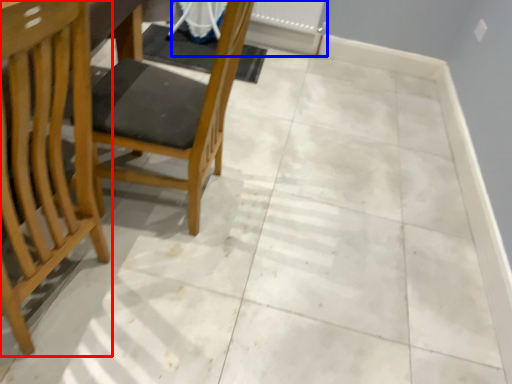
Question: Which object appears farthest to the camera in this image, chair (highlighted by a red box) or radiator (highlighted by a blue box)?

Choices:
 (A) chair
 (B) radiator

Answer: (B)